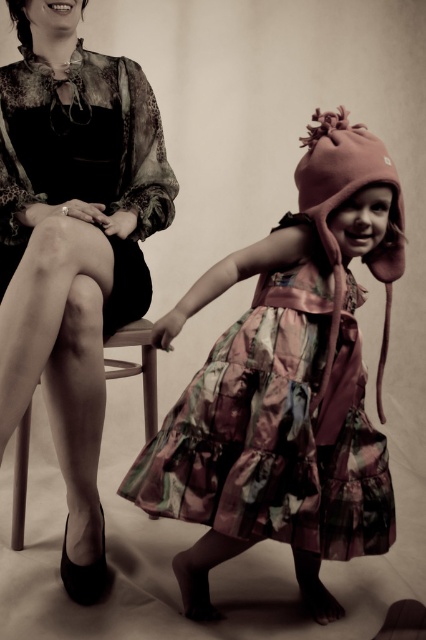
Question: Which is farther from the wooden chair at left?

Choices:
 (A) matte black dress at left
 (B) silky floral dress at left
 (C) shiny floral dress at center

Answer: (C)

Question: Is the position of matte black dress at left less distant than that of shiny floral dress at center?

Choices:
 (A) no
 (B) yes

Answer: (B)

Question: Which point appears closest to the camera in this image?

Choices:
 (A) (127, 372)
 (B) (60, 124)

Answer: (B)

Question: Among these points, which one is farthest from the camera?

Choices:
 (A) (170, 196)
 (B) (123, 268)
 (C) (353, 380)
 (D) (132, 330)

Answer: (D)

Question: From the image, what is the correct spatial relationship of shiny floral dress at center in relation to wooden chair at left?

Choices:
 (A) above
 (B) below

Answer: (A)

Question: Does shiny floral dress at center appear over silky floral dress at left?

Choices:
 (A) yes
 (B) no

Answer: (B)